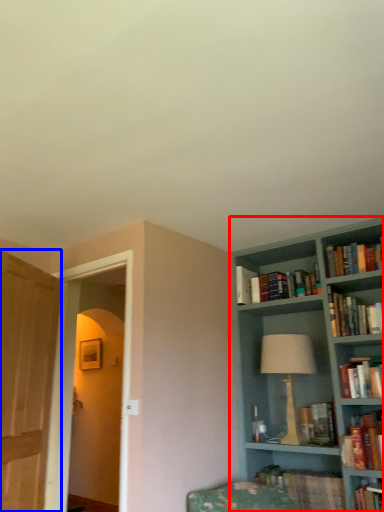
Question: Which point is further to the camera, bookcase (highlighted by a red box) or glass door (highlighted by a blue box)?

Choices:
 (A) bookcase
 (B) glass door

Answer: (A)